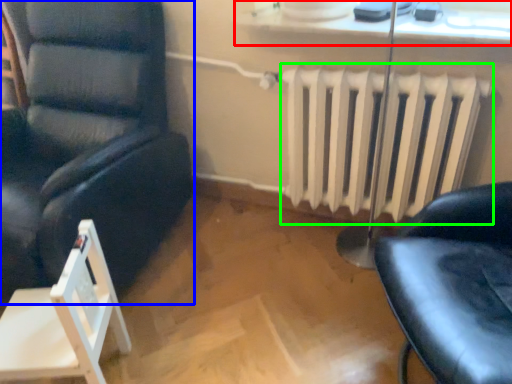
Question: Which object is the farthest from window sill (highlighted by a red box)? Choose among these: chair (highlighted by a blue box) or radiator (highlighted by a green box).

Choices:
 (A) chair
 (B) radiator

Answer: (A)